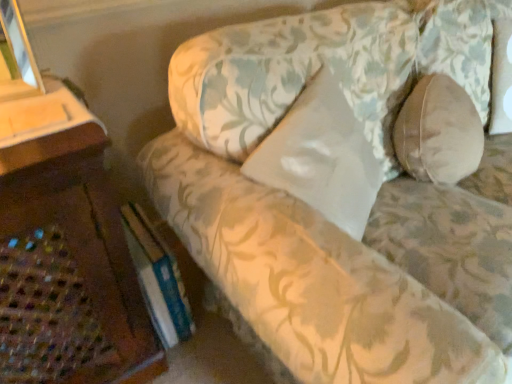
Question: Considering their positions, is white satin pillow at center, which is the second pillow in right-to-left order, located in front of or behind hardcover book at lower left?

Choices:
 (A) front
 (B) behind

Answer: (A)

Question: Considering the positions of point 324,208 and point 137,268, is point 324,208 closer or farther from the camera than point 137,268?

Choices:
 (A) farther
 (B) closer

Answer: (B)

Question: Estimate the real-world distances between objects in this image. Which object is closer to the white satin pillow at center, acting as the first pillow starting from the left?

Choices:
 (A) hardcover book at lower left
 (B) floral fabric couch at center
 (C) beige fabric pillow at right, the first pillow positioned from the right

Answer: (B)

Question: Considering the real-world distances, which object is farthest from the beige fabric pillow at right, the second pillow from the left?

Choices:
 (A) white satin pillow at center, acting as the first pillow starting from the left
 (B) hardcover book at lower left
 (C) floral fabric couch at center

Answer: (B)